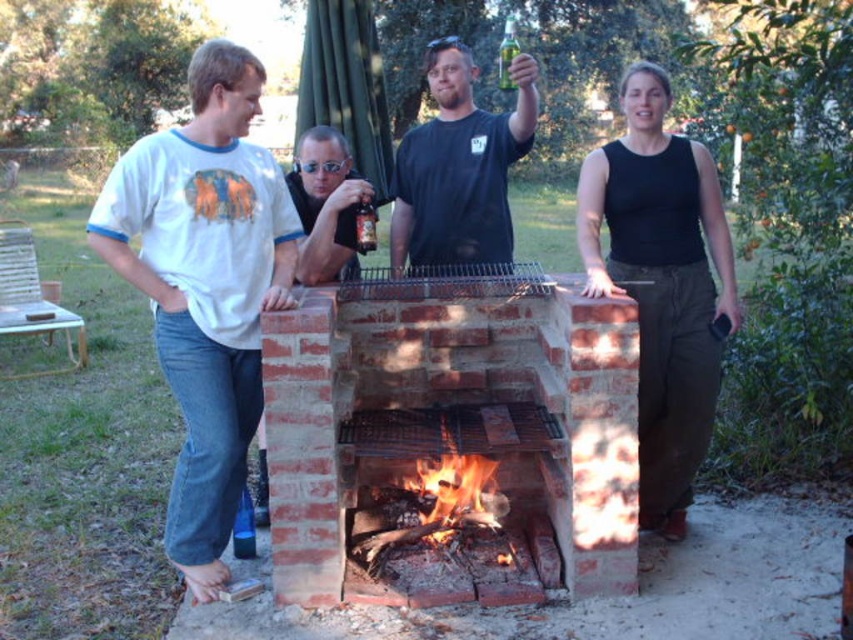
Does white t-shirt at left appear under flaming wood at center?

Actually, white t-shirt at left is above flaming wood at center.

Does white t-shirt at left have a greater height compared to flaming wood at center?

Correct, white t-shirt at left is much taller as flaming wood at center.

Which is behind, point (219, 296) or point (456, 525)?

The point (456, 525) is more distant.

Locate an element on the screen. The width and height of the screenshot is (853, 640). white t-shirt at left is located at coordinates (206, 285).

Can you confirm if red brick fireplace at center is wider than black sleeveless top at right?

Yes, red brick fireplace at center is wider than black sleeveless top at right.

Which is above, red brick fireplace at center or black sleeveless top at right?

black sleeveless top at right is above.

Between point (561, 468) and point (590, 179), which one is positioned in front?

Point (561, 468)

Where is `red brick fireplace at center`? Image resolution: width=853 pixels, height=640 pixels. red brick fireplace at center is located at coordinates (454, 433).

Is point (396, 307) less distant than point (263, 83)?

No.

Which of these two, red brick fireplace at center or white t-shirt at left, stands shorter?

With less height is red brick fireplace at center.

Which is in front, point (525, 390) or point (273, 228)?

Point (273, 228) is in front.

This screenshot has height=640, width=853. In order to click on red brick fireplace at center in this screenshot , I will do (x=454, y=433).